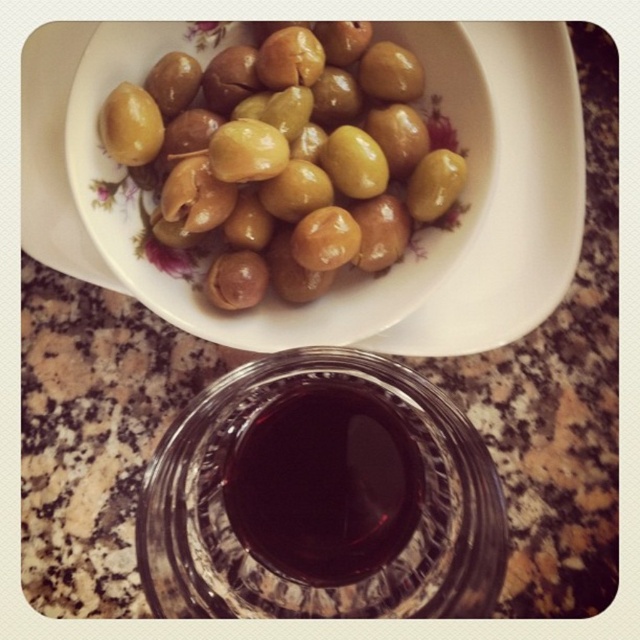
Does transparent glass bowl at center have a greater width compared to dark glass wine at center?

Yes, transparent glass bowl at center is wider than dark glass wine at center.

Does transparent glass bowl at center have a lesser height compared to dark glass wine at center?

In fact, transparent glass bowl at center may be taller than dark glass wine at center.

Is point (392, 408) closer to viewer compared to point (397, 454)?

No, (392, 408) is behind (397, 454).

Identify the location of transparent glass bowl at center. (321, 497).

Is green glossy olives at upper center above dark glass wine at center?

Correct, green glossy olives at upper center is located above dark glass wine at center.

Which of these two, green glossy olives at upper center or dark glass wine at center, stands shorter?

dark glass wine at center

Is point (307, 29) farther from camera compared to point (284, 570)?

Yes, point (307, 29) is farther from viewer.

You are a GUI agent. You are given a task and a screenshot of the screen. Output one action in this format:
    pyautogui.click(x=<x>, y=<y>)
    Task: Click on the green glossy olives at upper center
    
    Given the screenshot: What is the action you would take?
    pyautogui.click(x=284, y=157)

Which is more to the right, transparent glass bowl at center or green glossy olives at upper center?

Positioned to the right is transparent glass bowl at center.

Between point (266, 561) and point (396, 134), which one is positioned behind?

Positioned behind is point (396, 134).

Identify the location of transparent glass bowl at center. The image size is (640, 640). (321, 497).